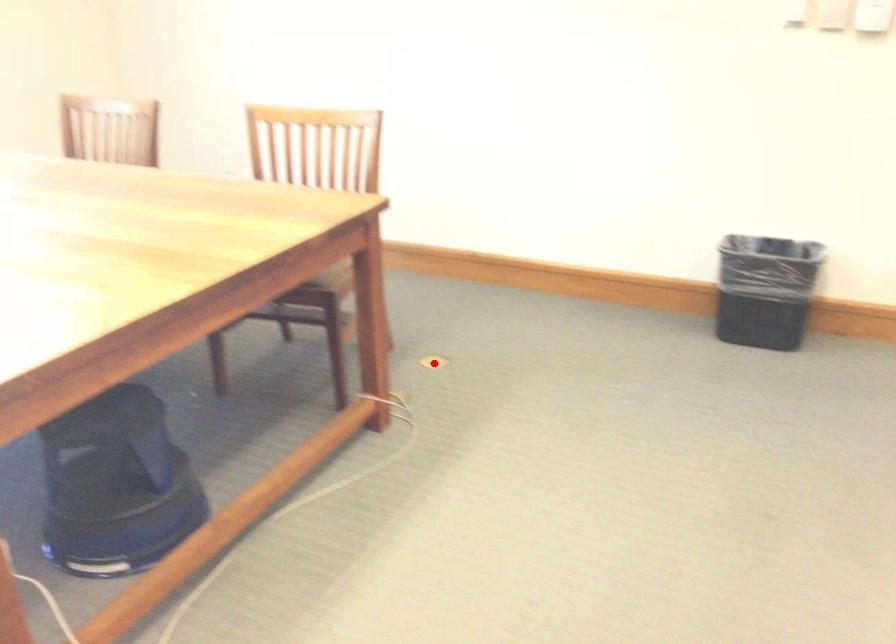
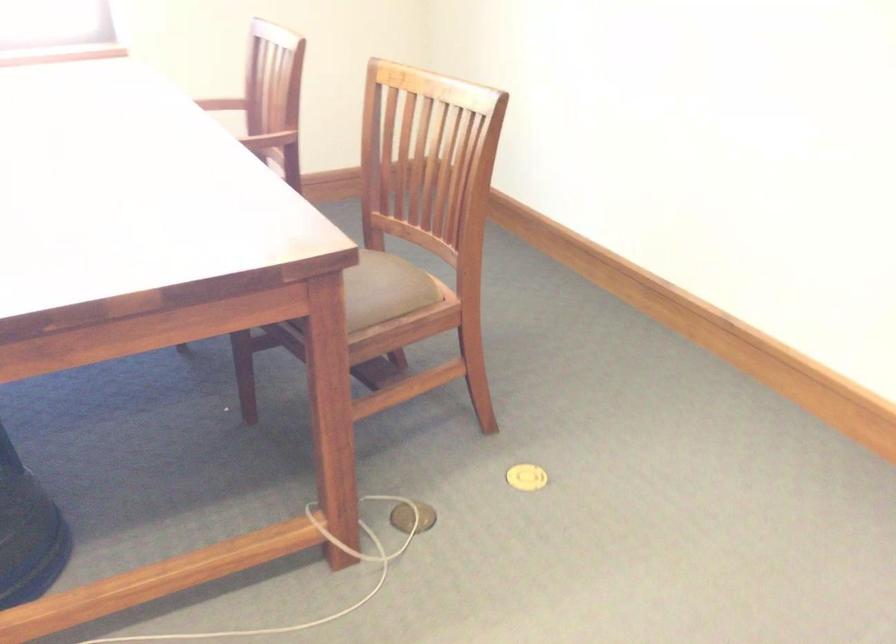
Question: I am providing you with two images of the same scene from different viewpoints. A red point is marked on the first image. Can you still see the location of the red point in image 2?

Choices:
 (A) Yes
 (B) No

Answer: (A)